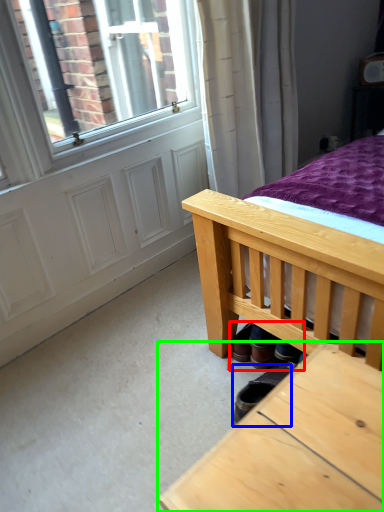
Question: Based on their relative distances, which object is farther from shoe (highlighted by a red box)? Choose from footwear (highlighted by a blue box) and table (highlighted by a green box).

Choices:
 (A) footwear
 (B) table

Answer: (B)